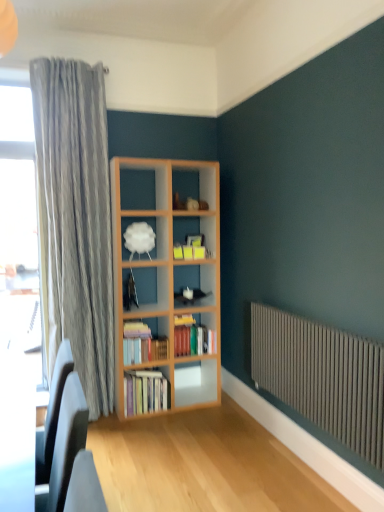
Question: Does gray metallic radiator at lower right have a lesser width compared to white matte cloud at center?

Choices:
 (A) no
 (B) yes

Answer: (B)

Question: Is gray metallic radiator at lower right next to white matte cloud at center and touching it?

Choices:
 (A) no
 (B) yes

Answer: (A)

Question: Is gray metallic radiator at lower right shorter than white matte cloud at center?

Choices:
 (A) no
 (B) yes

Answer: (A)

Question: Does gray metallic radiator at lower right come in front of white matte cloud at center?

Choices:
 (A) yes
 (B) no

Answer: (A)

Question: From the image's perspective, does gray metallic radiator at lower right appear higher than white matte cloud at center?

Choices:
 (A) yes
 (B) no

Answer: (B)

Question: Does gray metallic radiator at lower right come behind white matte cloud at center?

Choices:
 (A) yes
 (B) no

Answer: (B)

Question: From the image's perspective, is hardcover books at center, the 1th book from the top, on top of hardcover books at center, placed as the second book when sorted from bottom to top?

Choices:
 (A) yes
 (B) no

Answer: (A)

Question: Would you consider hardcover books at center, the 1th book from the top, to be distant from hardcover books at center, which is the second book in top-to-bottom order?

Choices:
 (A) yes
 (B) no

Answer: (B)

Question: Is hardcover books at center, the 1th book from the top, thinner than hardcover books at center, which is the second book in top-to-bottom order?

Choices:
 (A) no
 (B) yes

Answer: (A)

Question: Is hardcover books at center, the 1th book from the top, facing away from hardcover books at center, which is the second book in top-to-bottom order?

Choices:
 (A) yes
 (B) no

Answer: (B)

Question: Can you confirm if hardcover books at center, the 1th book from the top, is shorter than hardcover books at center, which is the second book in top-to-bottom order?

Choices:
 (A) no
 (B) yes

Answer: (A)

Question: From the image's perspective, does hardcover books at center, the 1th book from the top, appear lower than hardcover books at center, which is the second book in top-to-bottom order?

Choices:
 (A) yes
 (B) no

Answer: (B)

Question: Does matte black swivel chair at lower left have a greater height compared to hardcover books at center, the 3th book viewed from the top?

Choices:
 (A) no
 (B) yes

Answer: (B)